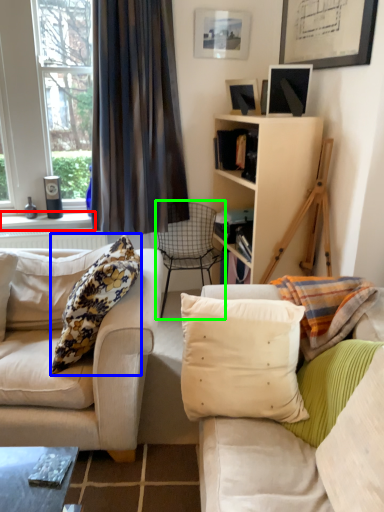
Question: Which object is positioned farthest from window sill (highlighted by a red box)? Select from pillow (highlighted by a blue box) and chair (highlighted by a green box).

Choices:
 (A) pillow
 (B) chair

Answer: (A)